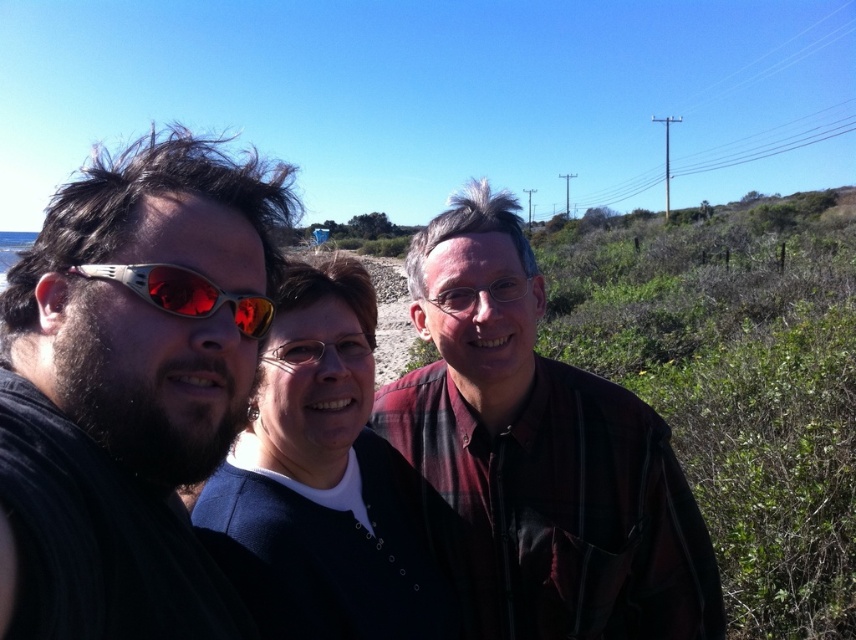
You are a photographer trying to adjust the lighting for a group photo. You notice the matte black shirt at left and the dark blue sweater at center. Which clothing item might cast a larger shadow due to its position?

The matte black shirt at left is positioned over the dark blue sweater at center, so it is higher and would cast a larger shadow over the dark blue sweater at center.

You are a photographer holding a camera that requires a minimum of 16 inches between subjects to avoid blurring. You see the plaid shirt at center and the dark blue sweater at center in your frame. Can you capture a clear photo without blurring?

The distance between the plaid shirt at center and dark blue sweater at center is 15.85 inches, which is less than the required 16 inches. Therefore, the camera might blur the subjects due to insufficient spacing.